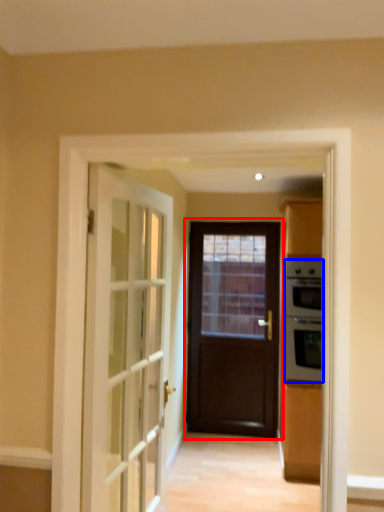
Question: Which object is closer to the camera taking this photo, door (highlighted by a red box) or appliance (highlighted by a blue box)?

Choices:
 (A) door
 (B) appliance

Answer: (B)